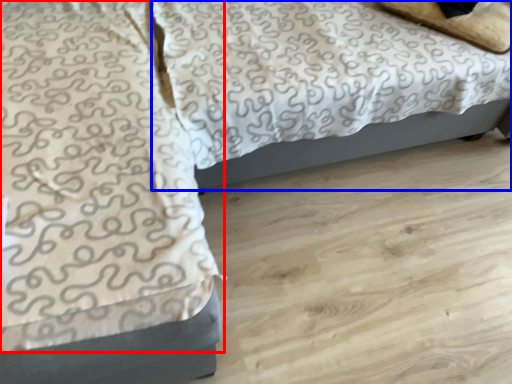
Question: Which of the following is the farthest to the observer, blanket (highlighted by a red box) or bed (highlighted by a blue box)?

Choices:
 (A) blanket
 (B) bed

Answer: (B)